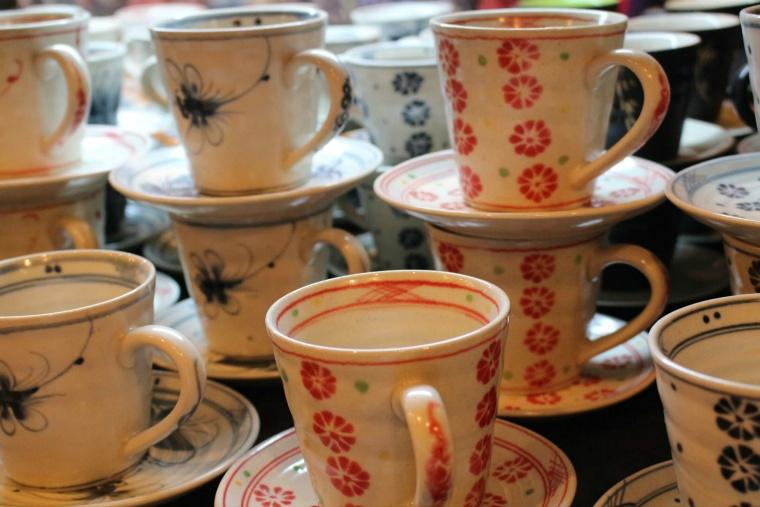
Identify the location of vintage teacup handles. This screenshot has width=760, height=507. (81, 99), (83, 237), (190, 388), (342, 98), (347, 251), (429, 452), (654, 277), (657, 93).